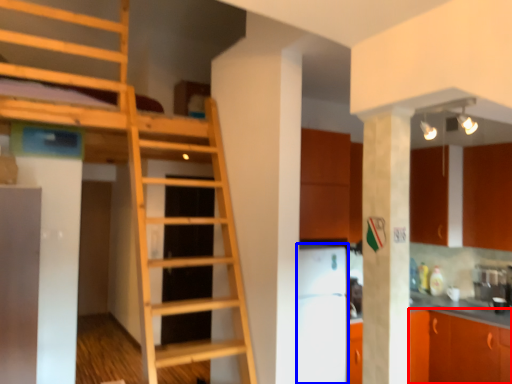
Question: Which object is closer to the camera taking this photo, cabinetry (highlighted by a red box) or appliance (highlighted by a blue box)?

Choices:
 (A) cabinetry
 (B) appliance

Answer: (B)